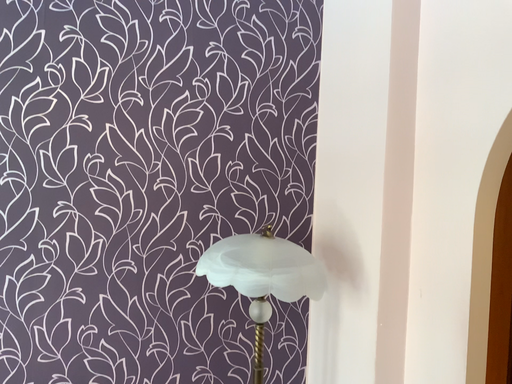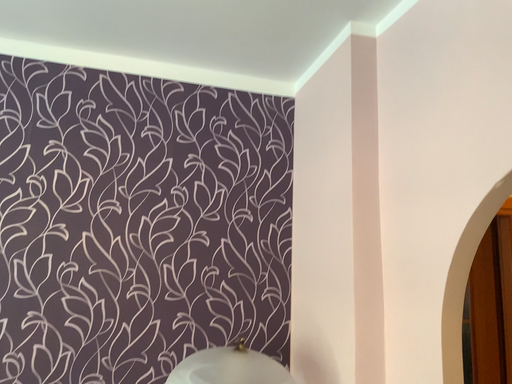
Question: How did the camera likely rotate when shooting the video?

Choices:
 (A) rotated upward
 (B) rotated downward

Answer: (A)